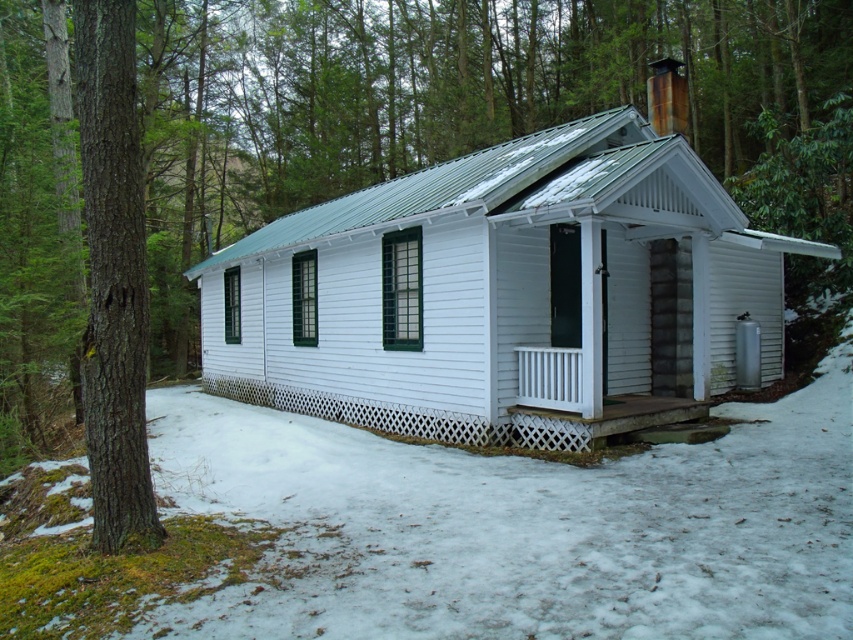
Is brown rough bark tree at left below white lattice porch at lower center?

No, brown rough bark tree at left is not below white lattice porch at lower center.

Is point (90, 337) positioned before point (321, 406)?

Yes, it is.

Identify the location of brown rough bark tree at left. pos(113,276).

Does white wooden cabin at center have a lesser width compared to brown rough bark tree at left?

No.

The height and width of the screenshot is (640, 853). What do you see at coordinates (503, 294) in the screenshot? I see `white wooden cabin at center` at bounding box center [503, 294].

I want to click on white wooden cabin at center, so click(x=503, y=294).

Can you confirm if white wooden cabin at center is taller than white lattice porch at lower center?

Yes, white wooden cabin at center is taller than white lattice porch at lower center.

Is white wooden cabin at center thinner than white lattice porch at lower center?

In fact, white wooden cabin at center might be wider than white lattice porch at lower center.

Which is behind, point (518, 218) or point (305, 392)?

Positioned behind is point (305, 392).

Where is `white wooden cabin at center`? white wooden cabin at center is located at coordinates (503, 294).